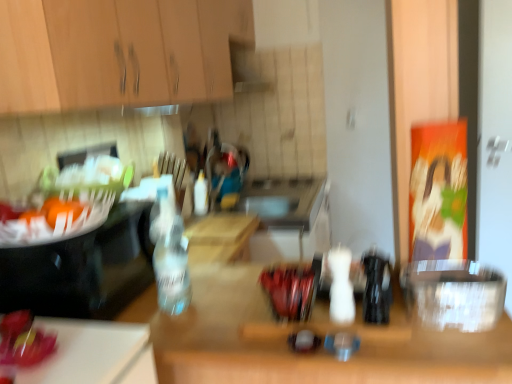
Find the location of a particular element. The height and width of the screenshot is (384, 512). free location in front of white matte bottle at center, which is the 2th bottle in back-to-front order is located at coordinates point(360,330).